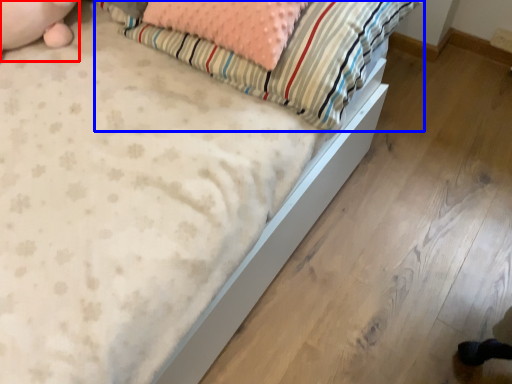
Question: Which of the following is the farthest to the observer, animal (highlighted by a red box) or pillow (highlighted by a blue box)?

Choices:
 (A) animal
 (B) pillow

Answer: (A)